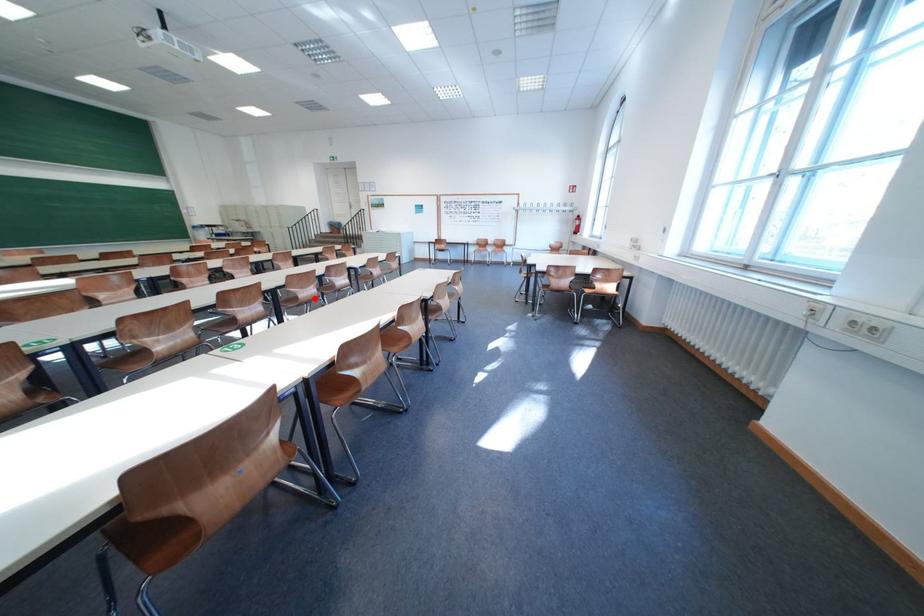
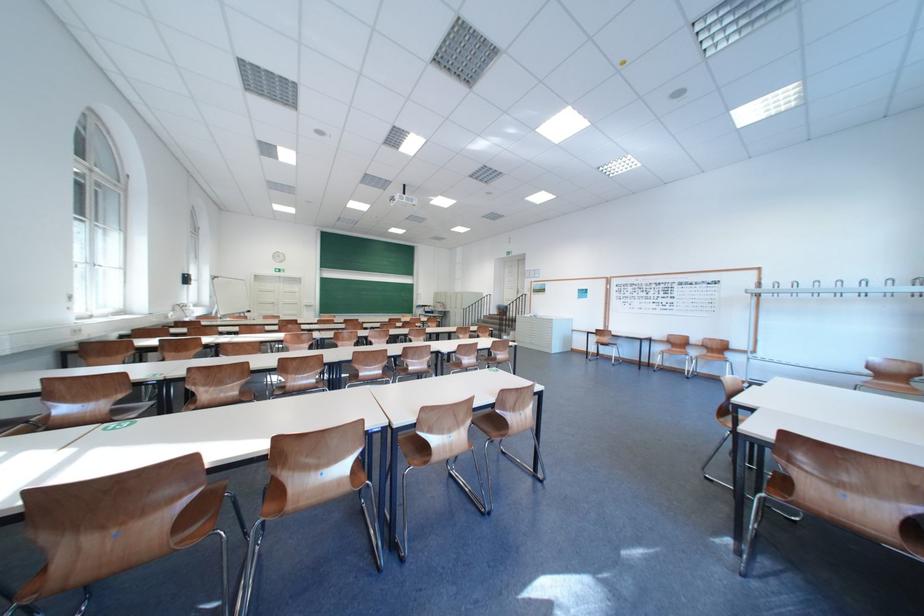
Question: I am providing you with two images of the same scene from different viewpoints. A red point is shown in image1. For the corresponding object point in image2, is it positioned nearer or farther from the camera?

Choices:
 (A) Nearer
 (B) Farther

Answer: (A)